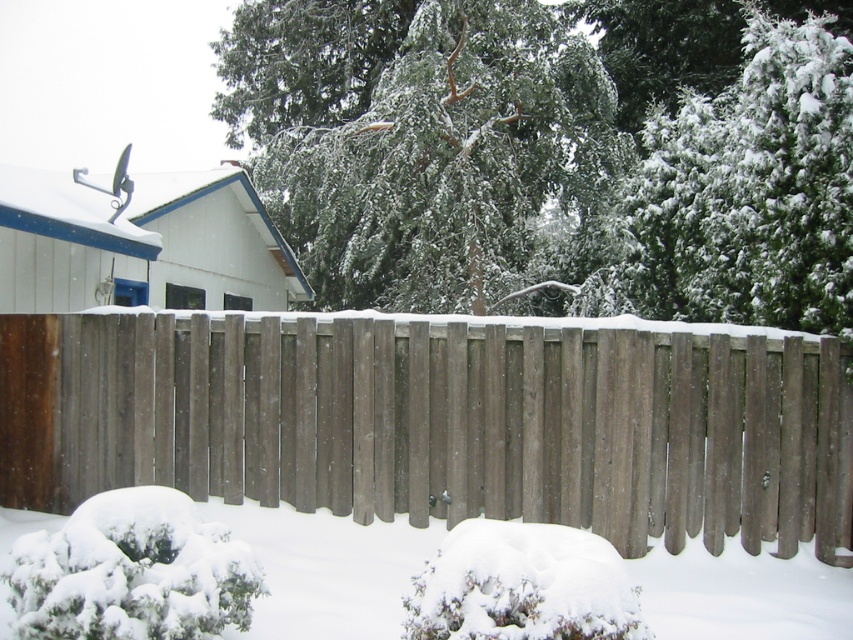
You are standing in a winter wonderland and see the brown wood fence at center and the white fluffy snow at center. Which object is closer to you?

The brown wood fence at center is closer to you than the white fluffy snow at center.

You are planning to build a snowman using the white fluffy snow at center, but you need to ensure there is enough space between the brown wood fence at center and the snow to work. Based on the scene, can you determine if the snow pile is wider than the fence?

The brown wood fence at center is wider than the white fluffy snow at center, so the snow pile is narrower. Therefore, there should be enough space between them for building the snowman.

You are standing in the snowy scene and want to take a photo of the white fluffy snow at center and the green textured tree at upper center. Which object will appear closer to the camera in the photo?

The green textured tree at upper center will appear closer to the camera because the white fluffy snow at center is behind it.